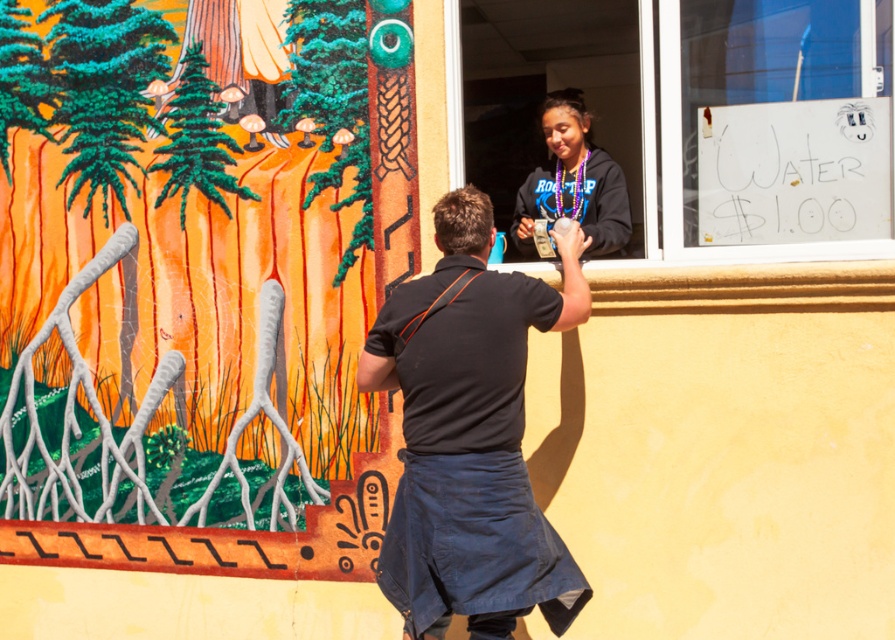
Question: Does black cotton shirt at center appear on the right side of matte black hoodie at center?

Choices:
 (A) yes
 (B) no

Answer: (B)

Question: Which object appears farthest from the camera in this image?

Choices:
 (A) matte orange wall at center
 (B) transparent glass window at upper center
 (C) black cotton shirt at center

Answer: (A)

Question: Which object is closer to the camera taking this photo?

Choices:
 (A) matte black hoodie at center
 (B) black cotton shirt at center
 (C) matte orange wall at center
 (D) transparent glass window at upper center

Answer: (B)

Question: Can you confirm if black cotton shirt at center is smaller than matte black hoodie at center?

Choices:
 (A) yes
 (B) no

Answer: (B)

Question: Is matte orange wall at center closer to the viewer compared to black cotton shirt at center?

Choices:
 (A) no
 (B) yes

Answer: (A)

Question: Which is farther from the black cotton shirt at center?

Choices:
 (A) transparent glass window at upper center
 (B) matte orange wall at center

Answer: (B)